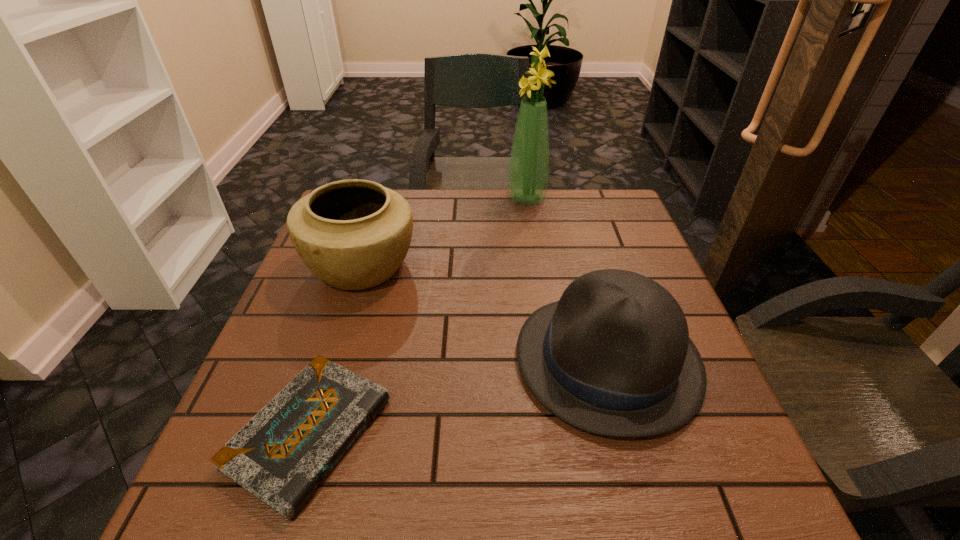
The width and height of the screenshot is (960, 540). I want to click on unoccupied area between the bowler hat and the notebook, so click(458, 396).

Image resolution: width=960 pixels, height=540 pixels. In order to click on unoccupied area between the pottery and the notebook in this screenshot , I will do `click(336, 349)`.

Identify the location of empty location between the tallest object and the bowler hat. (566, 279).

This screenshot has width=960, height=540. In order to click on free spot between the bowler hat and the shortest object in this screenshot , I will do `click(458, 396)`.

The image size is (960, 540). I want to click on free space between the bowler hat and the pottery, so click(x=485, y=313).

What are the coordinates of `vacant point located between the bowler hat and the bouquet` in the screenshot? It's located at (566, 279).

Locate an element on the screen. Image resolution: width=960 pixels, height=540 pixels. free space between the notebook and the bowler hat is located at coordinates (458, 396).

Find the location of a particular element. The height and width of the screenshot is (540, 960). vacant space that is in between the pottery and the farthest object is located at coordinates (444, 232).

Locate an element on the screen. This screenshot has height=540, width=960. the third closest object relative to the pottery is located at coordinates (528, 172).

At what (x,y) coordinates should I click in order to perform the action: click on object that is the second closest to the pottery. Please return your answer as a coordinate pair (x, y). Looking at the image, I should click on (613, 357).